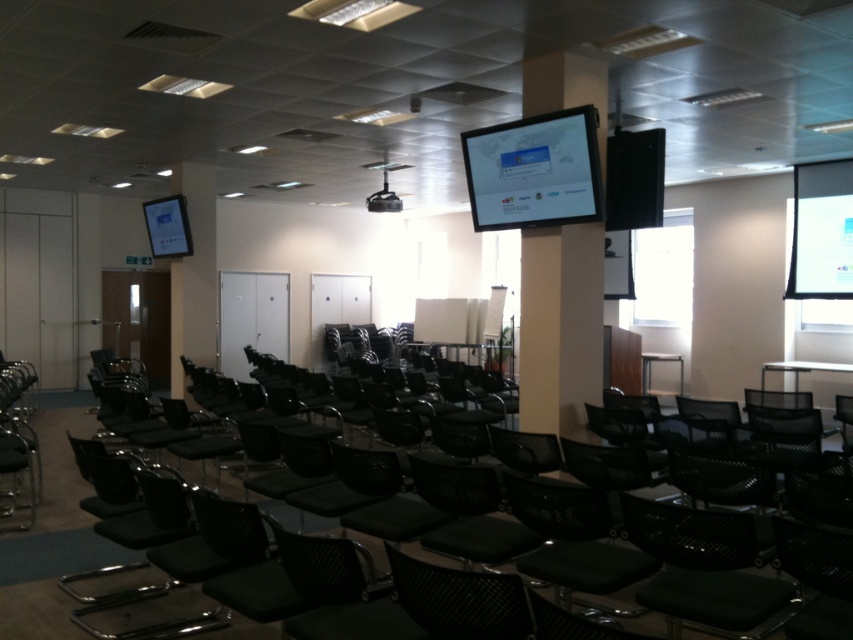
Image resolution: width=853 pixels, height=640 pixels. Describe the element at coordinates (709, 540) in the screenshot. I see `black mesh chair at lower left` at that location.

Is point (648, 504) in front of point (567, 259)?

That is True.

The image size is (853, 640). I want to click on black mesh chair at lower left, so click(x=709, y=540).

Can you confirm if black mesh swivel chair at lower right is taller than black plastic projector at center?

Yes.

Between black mesh swivel chair at lower right and black plastic projector at center, which one has more height?

With more height is black mesh swivel chair at lower right.

Is point (721, 545) behind point (380, 209)?

No.

Locate an element on the screen. The image size is (853, 640). black mesh swivel chair at lower right is located at coordinates (704, 568).

Is black mesh swivel chair at lower right smaller than matte black monitor at center?

Indeed, black mesh swivel chair at lower right has a smaller size compared to matte black monitor at center.

Is point (654, 592) closer to camera compared to point (560, 220)?

Yes, point (654, 592) is in front of point (560, 220).

The height and width of the screenshot is (640, 853). What do you see at coordinates (704, 568) in the screenshot?
I see `black mesh swivel chair at lower right` at bounding box center [704, 568].

Locate an element on the screen. Image resolution: width=853 pixels, height=640 pixels. black mesh swivel chair at lower right is located at coordinates (704, 568).